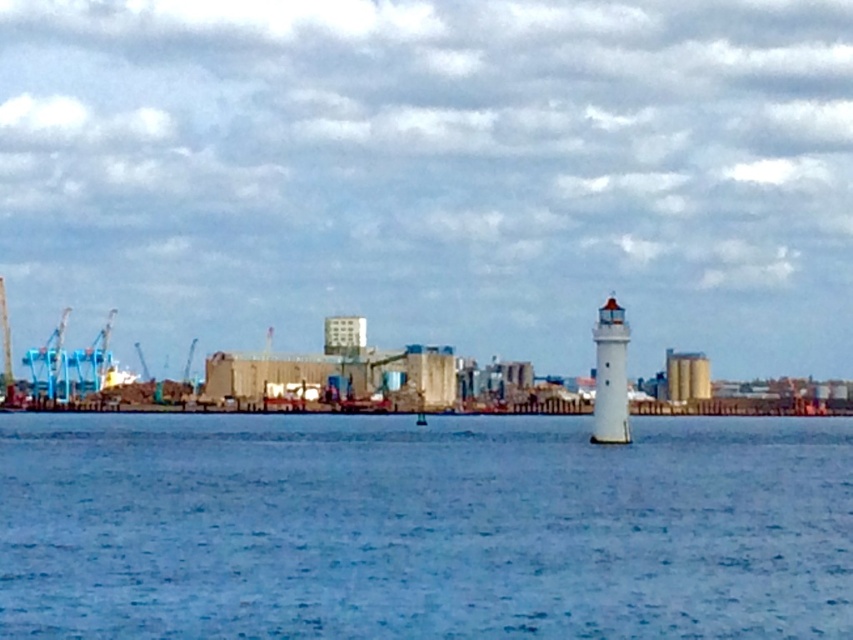
In the scene shown: You are a photographer planning to capture a wide shot of the coastal scene. You want to ensure that both the blue water at center and the white textured lighthouse at right are clearly visible in the frame. Based on their sizes in the image, which object will occupy more of the horizontal space in your photograph?

The blue water at center will occupy more horizontal space in the photograph because its width is larger than that of the white textured lighthouse at right.

You are a delivery truck driver who needs to park between the smooth beige silo at center right and the smooth concrete silo at center. Which silo should you park closer to if you want to maximize the space between your truck and both silos?

You should park closer to the smooth beige silo at center right since it has a lesser width compared to the smooth concrete silo at center, allowing for more space between your truck and both silos.